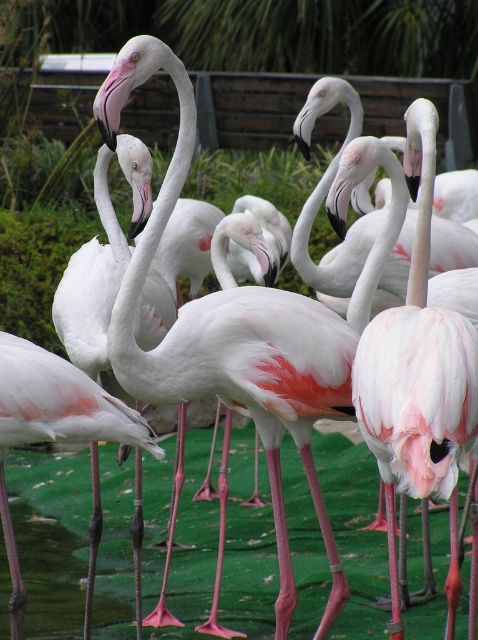
You are a zookeeper trying to place two flamingos into a small enclosure. The enclosure can only accommodate flamingos that are narrower than 30 cm in width. You observe the two flamingos labeled as matte pink flamingo at center and pink matte flamingo at center. Which of these flamingos can fit into the enclosure?

The matte pink flamingo at center has a width less than the pink matte flamingo at center. Since the enclosure requires flamingos narrower than 30 cm, the matte pink flamingo at center may fit if its width is under 30 cm, but the exact width isn

In the scene shown: You are a zookeeper observing two flamingos in the enclosure. You notice a matte pink flamingo at center and a pink matte flamingo at center. Which one is located to the right?

The matte pink flamingo at center is positioned on the right side of the pink matte flamingo at center, so it is the one located to the right.